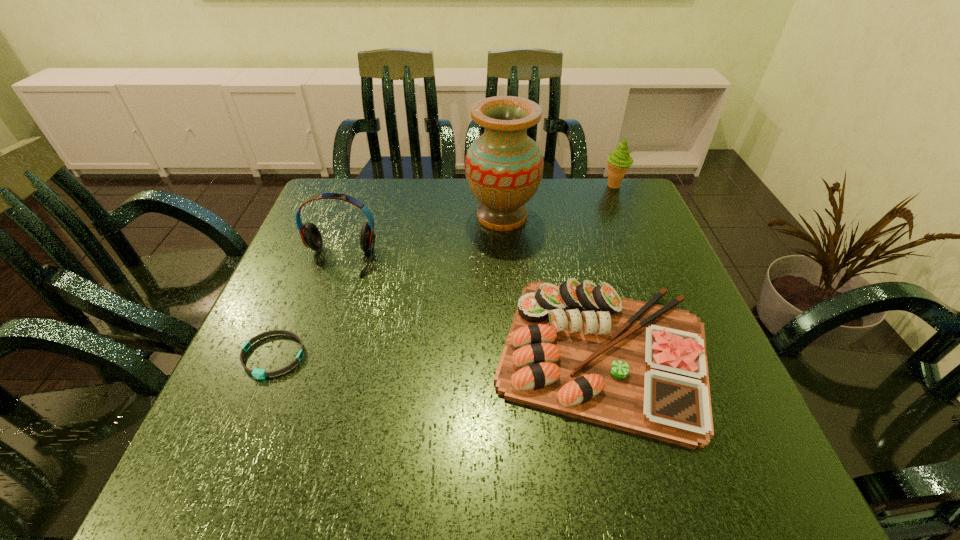
Where is `vacant point located between the shortest object and the vase`? vacant point located between the shortest object and the vase is located at coordinates (388, 286).

Find the location of a particular element. blank region between the farthest object and the wristband is located at coordinates (444, 271).

Locate an element on the screen. This screenshot has width=960, height=540. vacant area that lies between the third farthest object and the vase is located at coordinates (420, 238).

The image size is (960, 540). I want to click on empty space between the icecream and the third farthest object, so click(477, 222).

Identify the location of free area in between the icecream and the headset. (477, 222).

Image resolution: width=960 pixels, height=540 pixels. I want to click on free spot between the third farthest object and the icecream, so click(477, 222).

Find the location of a particular element. The height and width of the screenshot is (540, 960). vacant area that lies between the shortest object and the tallest object is located at coordinates (388, 286).

The image size is (960, 540). I want to click on object that stands as the second closest to the third farthest object, so [503, 167].

Identify which object is located as the third nearest to the third farthest object. Please provide its 2D coordinates. Your answer should be formatted as a tuple, i.e. [(x, y)], where the tuple contains the x and y coordinates of a point satisfying the conditions above.

[(577, 349)]

This screenshot has width=960, height=540. In order to click on vacant point that satisfies the following two spatial constraints: 1. on the front side of the platter; 2. on the right side of the vase in this screenshot , I will do `click(511, 354)`.